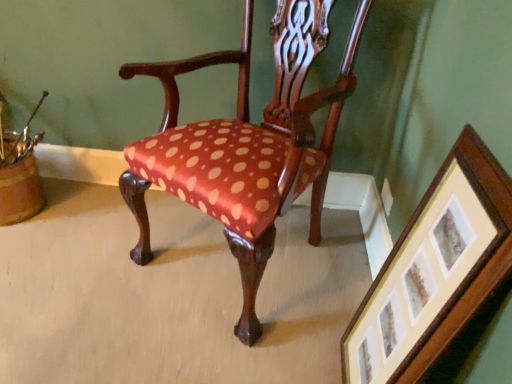
Find the location of a particular element. wooden picture frame at lower right is located at coordinates (435, 270).

What do you see at coordinates (435, 270) in the screenshot?
I see `wooden picture frame at lower right` at bounding box center [435, 270].

What is the approximate width of satin-polka dot chair at center?

The width of satin-polka dot chair at center is 59.24 centimeters.

This screenshot has width=512, height=384. Describe the element at coordinates (246, 145) in the screenshot. I see `satin-polka dot chair at center` at that location.

This screenshot has height=384, width=512. Identify the location of satin-polka dot chair at center. (246, 145).

In the scene shown: Measure the distance between point (310,9) and camera.

Point (310,9) and camera are 1.29 meters apart.

The width and height of the screenshot is (512, 384). Find the location of `wooden picture frame at lower right`. wooden picture frame at lower right is located at coordinates [435, 270].

Considering the positions of objects wooden picture frame at lower right and satin-polka dot chair at center in the image provided, who is more to the right, wooden picture frame at lower right or satin-polka dot chair at center?

From the viewer's perspective, wooden picture frame at lower right appears more on the right side.

Is wooden picture frame at lower right in front of or behind satin-polka dot chair at center in the image?

In the image, wooden picture frame at lower right appears in front of satin-polka dot chair at center.

Which is behind, point (367, 318) or point (245, 320)?

The point (245, 320) is farther from the camera.

From the image's perspective, would you say wooden picture frame at lower right is positioned over satin-polka dot chair at center?

Actually, wooden picture frame at lower right appears below satin-polka dot chair at center in the image.

From a real-world perspective, is wooden picture frame at lower right on satin-polka dot chair at center?

No.

Looking at their sizes, would you say wooden picture frame at lower right is wider or thinner than satin-polka dot chair at center?

In the image, wooden picture frame at lower right appears to be more narrow than satin-polka dot chair at center.

Considering the relative sizes of wooden picture frame at lower right and satin-polka dot chair at center in the image provided, is wooden picture frame at lower right taller than satin-polka dot chair at center?

No, wooden picture frame at lower right is not taller than satin-polka dot chair at center.

Between wooden picture frame at lower right and satin-polka dot chair at center, which one has larger size?

Bigger between the two is satin-polka dot chair at center.

Could satin-polka dot chair at center be considered to be inside wooden picture frame at lower right?

No, satin-polka dot chair at center is not inside wooden picture frame at lower right.

Is wooden picture frame at lower right not near satin-polka dot chair at center?

That's not correct — wooden picture frame at lower right is a little close to satin-polka dot chair at center.

Is wooden picture frame at lower right positioned with its back to satin-polka dot chair at center?

No.

How many degrees apart are the facing directions of wooden picture frame at lower right and satin-polka dot chair at center?

There is a 57.6-degree angle between the facing directions of wooden picture frame at lower right and satin-polka dot chair at center.

Where is `picture frame that appears in front of the satin-polka dot chair at center`? The width and height of the screenshot is (512, 384). picture frame that appears in front of the satin-polka dot chair at center is located at coordinates (435, 270).

Does satin-polka dot chair at center appear on the left side of wooden picture frame at lower right?

Yes.

Between satin-polka dot chair at center and wooden picture frame at lower right, which one is positioned in front?

wooden picture frame at lower right.

Between point (217, 211) and point (438, 197), which one is positioned behind?

Positioned behind is point (217, 211).

From the image's perspective, between satin-polka dot chair at center and wooden picture frame at lower right, who is located below?

wooden picture frame at lower right.

From a real-world perspective, which is physically above, satin-polka dot chair at center or wooden picture frame at lower right?

satin-polka dot chair at center.

Considering the sizes of satin-polka dot chair at center and wooden picture frame at lower right in the image, is satin-polka dot chair at center wider or thinner than wooden picture frame at lower right?

In the image, satin-polka dot chair at center appears to be wider than wooden picture frame at lower right.

Who is shorter, satin-polka dot chair at center or wooden picture frame at lower right?

With less height is wooden picture frame at lower right.

Based on their sizes in the image, would you say satin-polka dot chair at center is bigger or smaller than wooden picture frame at lower right?

In the image, satin-polka dot chair at center appears to be larger than wooden picture frame at lower right.

Is satin-polka dot chair at center completely or partially outside of wooden picture frame at lower right?

Yes.

Is satin-polka dot chair at center positioned far away from wooden picture frame at lower right?

satin-polka dot chair at center is actually quite close to wooden picture frame at lower right.

Is wooden picture frame at lower right at the back of satin-polka dot chair at center?

No, satin-polka dot chair at center's orientation is not away from wooden picture frame at lower right.

Measure the distance between satin-polka dot chair at center and wooden picture frame at lower right.

The distance of satin-polka dot chair at center from wooden picture frame at lower right is 19.34 inches.

I want to click on picture frame that appears on the right of satin-polka dot chair at center, so click(435, 270).

In the image, there is a satin-polka dot chair at center. Where is `picture frame below it (from a real-world perspective)`? This screenshot has width=512, height=384. picture frame below it (from a real-world perspective) is located at coordinates (x=435, y=270).

This screenshot has width=512, height=384. In order to click on chair that appears above the wooden picture frame at lower right (from the image's perspective) in this screenshot , I will do `click(246, 145)`.